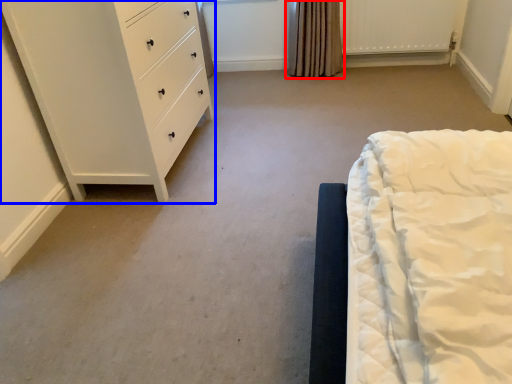
Question: Which of the following is the farthest to the observer, curtain (highlighted by a red box) or chest of drawers (highlighted by a blue box)?

Choices:
 (A) curtain
 (B) chest of drawers

Answer: (A)